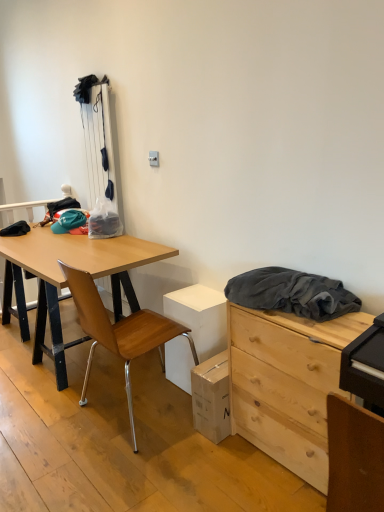
Where is `vacant region under wooden at left (from a real-world perspective)`? vacant region under wooden at left (from a real-world perspective) is located at coordinates click(x=124, y=404).